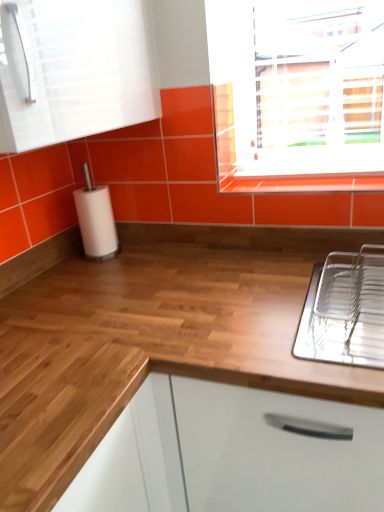
At what (x,y) coordinates should I click in order to perform the action: click on glossy orange tile at upper center. Please return your answer as a coordinate pair (x, y). This screenshot has width=384, height=512. Looking at the image, I should click on (302, 183).

The width and height of the screenshot is (384, 512). What do you see at coordinates (96, 222) in the screenshot? I see `white matte paper towel at left` at bounding box center [96, 222].

At what (x,y) coordinates should I click in order to perform the action: click on white matte paper towel at left. Please return your answer as a coordinate pair (x, y). Looking at the image, I should click on (96, 222).

Describe the element at coordinates (345, 310) in the screenshot. I see `clear plastic dish rack at right` at that location.

This screenshot has height=512, width=384. Identify the location of clear plastic dish rack at right. (345, 310).

The height and width of the screenshot is (512, 384). I want to click on wooden at center, so tap(151, 335).

Considering the relative sizes of white glossy cabinet at upper left and white matte paper towel at left in the image provided, is white glossy cabinet at upper left bigger than white matte paper towel at left?

Correct, white glossy cabinet at upper left is larger in size than white matte paper towel at left.

Which is closer to the camera, (x=49, y=16) or (x=85, y=250)?

Point (x=49, y=16) appears to be closer to the viewer than point (x=85, y=250).

Is white matte paper towel at left at the back of white glossy cabinet at upper left?

No, white matte paper towel at left is not at the back of white glossy cabinet at upper left.

From the image's perspective, which object appears higher, white glossy cabinet at upper left or white matte paper towel at left?

white glossy cabinet at upper left, from the image's perspective.

Does clear plastic dish rack at right have a lesser height compared to white matte paper towel at left?

Yes, clear plastic dish rack at right is shorter than white matte paper towel at left.

Is clear plastic dish rack at right to the right of white matte paper towel at left from the viewer's perspective?

Yes.

In the scene shown: Is clear plastic dish rack at right positioned before white matte paper towel at left?

Yes, clear plastic dish rack at right is closer to the viewer.

From a real-world perspective, which object stands above the other?

In real-world perspective, white matte paper towel at left is above.

Where is `appliance below the white matte paper towel at left (from a real-world perspective)`? The width and height of the screenshot is (384, 512). appliance below the white matte paper towel at left (from a real-world perspective) is located at coordinates (345, 310).

Which is less distant, (77, 209) or (369, 321)?

Point (77, 209) is farther from the camera than point (369, 321).

Is white matte paper towel at left further to camera compared to clear plastic dish rack at right?

That is True.

Looking at this image, is white matte paper towel at left completely or partially outside of clear plastic dish rack at right?

Indeed, white matte paper towel at left is completely outside clear plastic dish rack at right.

From a real-world perspective, which is physically below, wooden at center or clear plastic dish rack at right?

In real-world perspective, wooden at center is lower.

In the image, there is a clear plastic dish rack at right. Identify the location of countertop below it (from a real-world perspective). (151, 335).

Is there a large distance between wooden at center and clear plastic dish rack at right?

wooden at center is near clear plastic dish rack at right, not far away.

Based on their positions, is wooden at center located to the left or right of clear plastic dish rack at right?

From the image, it's evident that wooden at center is to the left of clear plastic dish rack at right.

Which object is positioned more to the right, white glossy cabinet at upper left or wooden at center?

From the viewer's perspective, wooden at center appears more on the right side.

Is white glossy cabinet at upper left looking in the opposite direction of wooden at center?

That's not correct — white glossy cabinet at upper left is not looking away from wooden at center.

Between white glossy cabinet at upper left and wooden at center, which one has larger width?

wooden at center.

From the image's perspective, is white glossy cabinet at upper left located above or below glossy orange tile at upper center?

Clearly, from the image's perspective, white glossy cabinet at upper left is above glossy orange tile at upper center.

From a real-world perspective, between white glossy cabinet at upper left and glossy orange tile at upper center, who is vertically lower?

In real-world perspective, glossy orange tile at upper center is lower.

This screenshot has width=384, height=512. I want to click on window sill below the white glossy cabinet at upper left (from a real-world perspective), so click(302, 183).

Are white glossy cabinet at upper left and glossy orange tile at upper center making contact?

No, white glossy cabinet at upper left is not beside glossy orange tile at upper center.

Which of these two, wooden at center or white matte paper towel at left, stands shorter?

white matte paper towel at left is shorter.

In terms of width, does wooden at center look wider or thinner when compared to white matte paper towel at left?

In the image, wooden at center appears to be wider than white matte paper towel at left.

Which is closer, (34, 345) or (85, 217)?

Point (34, 345) is positioned closer to the camera compared to point (85, 217).

What are the coordinates of `cabinetry above the white matte paper towel at left (from a real-world perspective)` in the screenshot? It's located at (76, 70).

Where is `paper towel located above the clear plastic dish rack at right (from the image's perspective)`? The image size is (384, 512). paper towel located above the clear plastic dish rack at right (from the image's perspective) is located at coordinates (96, 222).

Considering their positions, is glossy orange tile at upper center positioned closer to clear plastic dish rack at right than white glossy cabinet at upper left?

glossy orange tile at upper center is positioned closer to the anchor clear plastic dish rack at right.

From the image, which object appears to be nearer to clear plastic dish rack at right, wooden at center or white matte paper towel at left?

The object closer to clear plastic dish rack at right is wooden at center.

From the image, which object appears to be farther from glossy orange tile at upper center, white matte paper towel at left or wooden at center?

Based on the image, white matte paper towel at left appears to be further to glossy orange tile at upper center.

From the image, which object appears to be nearer to white glossy cabinet at upper left, wooden at center or glossy orange tile at upper center?

Based on the image, wooden at center appears to be nearer to white glossy cabinet at upper left.

Estimate the real-world distances between objects in this image. Which object is closer to glossy orange tile at upper center, white glossy cabinet at upper left or wooden at center?

Based on the image, wooden at center appears to be nearer to glossy orange tile at upper center.

From the image, which object appears to be farther from white matte paper towel at left, white glossy cabinet at upper left or glossy orange tile at upper center?

The object further to white matte paper towel at left is glossy orange tile at upper center.

Considering their positions, is white glossy cabinet at upper left positioned further to glossy orange tile at upper center than clear plastic dish rack at right?

white glossy cabinet at upper left is positioned further to the anchor glossy orange tile at upper center.

Based on their spatial positions, is white matte paper towel at left or white glossy cabinet at upper left closer to clear plastic dish rack at right?

Among the two, white glossy cabinet at upper left is located nearer to clear plastic dish rack at right.

Locate an element on the screen. This screenshot has height=512, width=384. window sill between white glossy cabinet at upper left and clear plastic dish rack at right in the horizontal direction is located at coordinates (302, 183).

This screenshot has width=384, height=512. I want to click on window sill between white glossy cabinet at upper left and wooden at center vertically, so click(302, 183).

Identify the location of window sill located between white matte paper towel at left and clear plastic dish rack at right in the left-right direction. The width and height of the screenshot is (384, 512). (302, 183).

Find the location of a particular element. This screenshot has height=512, width=384. appliance that lies between glossy orange tile at upper center and wooden at center from top to bottom is located at coordinates (345, 310).